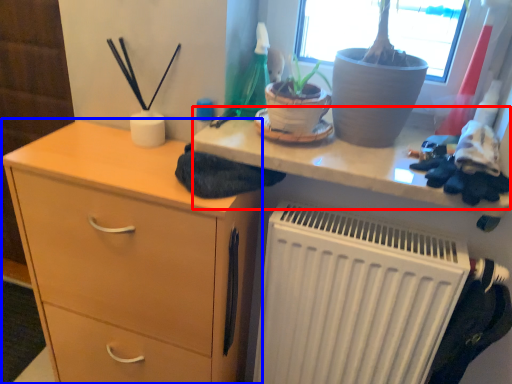
Question: Which of the following is the farthest to the observer, writing desk (highlighted by a red box) or chest of drawers (highlighted by a blue box)?

Choices:
 (A) writing desk
 (B) chest of drawers

Answer: (B)